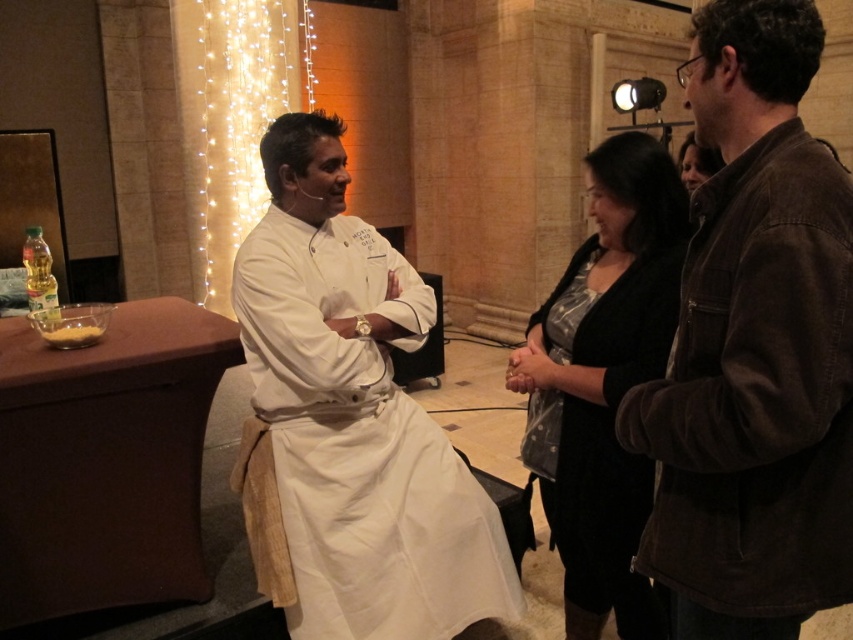
Which of these two, white cotton chef's coat at center or black textured sweater at center, stands taller?

With more height is black textured sweater at center.

Which is in front, point (392, 401) or point (651, 310)?

Point (651, 310) is in front.

Is point (410, 484) in front of point (576, 266)?

Yes, it is in front of point (576, 266).

At what (x,y) coordinates should I click in order to perform the action: click on white cotton chef's coat at center. Please return your answer as a coordinate pair (x, y). This screenshot has height=640, width=853. Looking at the image, I should click on (361, 444).

Does brown suede jacket at right appear over black textured sweater at center?

Yes, brown suede jacket at right is above black textured sweater at center.

Does brown suede jacket at right have a smaller size compared to black textured sweater at center?

Yes.

What are the coordinates of `brown suede jacket at right` in the screenshot? It's located at (753, 348).

Measure the distance from brown suede jacket at right to white cotton chef's coat at center.

brown suede jacket at right and white cotton chef's coat at center are 33.24 inches apart from each other.

Which is more to the left, brown suede jacket at right or white cotton chef's coat at center?

Positioned to the left is white cotton chef's coat at center.

The height and width of the screenshot is (640, 853). What do you see at coordinates (753, 348) in the screenshot? I see `brown suede jacket at right` at bounding box center [753, 348].

Where is `brown suede jacket at right`? brown suede jacket at right is located at coordinates (753, 348).